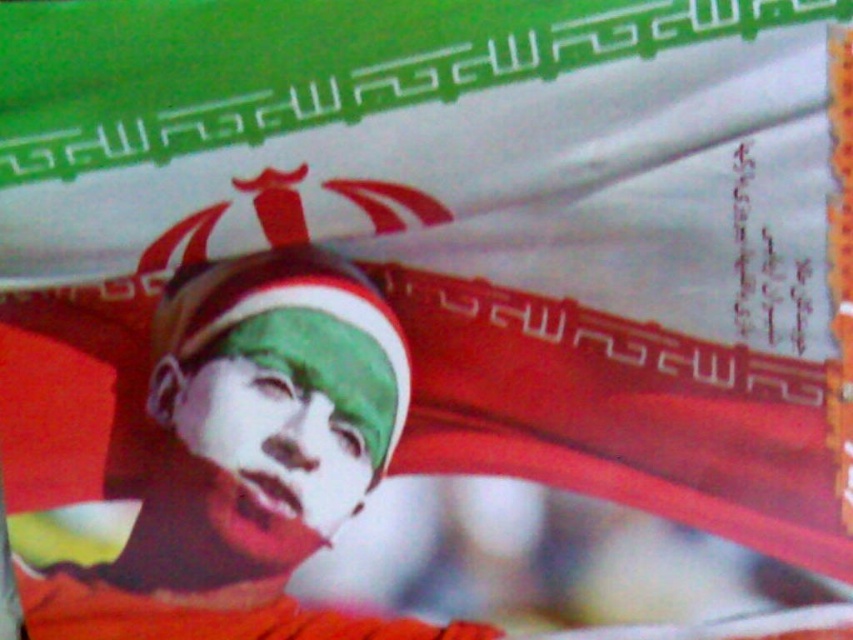
Consider the image. You are designing a poster and want to ensure that the matte green cap at center and the green matte face at center are proportionally balanced. Given their sizes, which object should you adjust to maintain visual harmony?

The matte green cap at center is wider than the green matte face at center. To maintain visual harmony, you should reduce the size of the matte green cap at center so that it is proportionally balanced with the green matte face at center.

You are an artist trying to paint this scene. You want to paint the matte green cap at center and the green matte face at center. Which object should you paint first to ensure proper layering?

You should paint the matte green cap at center first since it is closer to the viewer and needs to be layered over the green matte face at center.

Consider the image. You are an artist trying to draw the scene. You notice two objects at the center of the image. Which one is taller, the matte green cap at center or the green matte face at center?

The matte green cap at center is much taller than the green matte face at center according to the description.